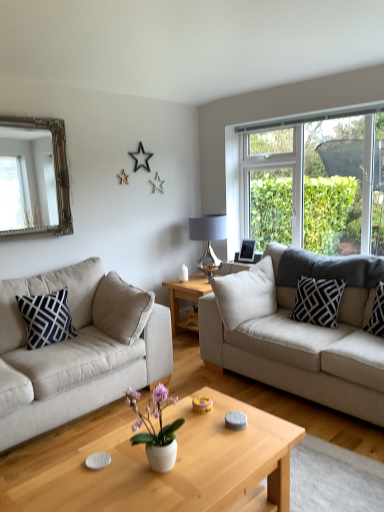
At what (x,y) coordinates should I click in order to perform the action: click on vacant space underneath white ceramic pot at center (from a real-world perspective). Please return your answer as a coordinate pair (x, y). Looking at the image, I should click on (155, 475).